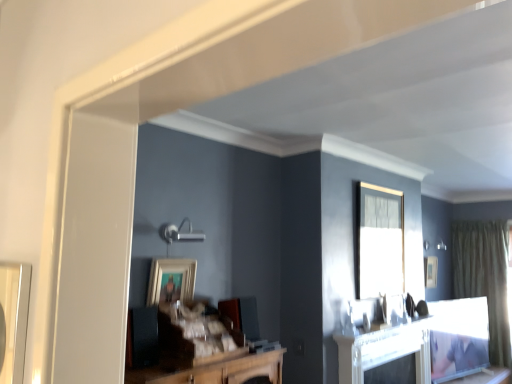
Question: Should I look upward or downward to see wooden framed picture at center, which appears as the 2th picture frame when viewed from the back?

Choices:
 (A) down
 (B) up

Answer: (A)

Question: Does wooden framed picture at center, which is the 1th picture frame in front-to-back order, lie behind white glossy fireplace at center?

Choices:
 (A) yes
 (B) no

Answer: (B)

Question: Considering the relative sizes of wooden framed picture at center, the first picture frame positioned from the left, and white glossy fireplace at center in the image provided, is wooden framed picture at center, the first picture frame positioned from the left, smaller than white glossy fireplace at center?

Choices:
 (A) no
 (B) yes

Answer: (B)

Question: Is wooden framed picture at center, acting as the 2th picture frame starting from the bottom, at the left side of white glossy fireplace at center?

Choices:
 (A) no
 (B) yes

Answer: (B)

Question: Does wooden framed picture at center, which appears as the 2th picture frame when viewed from the back, have a lesser height compared to white glossy fireplace at center?

Choices:
 (A) no
 (B) yes

Answer: (B)

Question: Is wooden framed picture at center, which appears as the 1th picture frame when viewed from the top, not inside white glossy fireplace at center?

Choices:
 (A) no
 (B) yes

Answer: (B)

Question: Does wooden framed picture at center, which appears as the 2th picture frame when viewed from the back, appear on the right side of white glossy fireplace at center?

Choices:
 (A) no
 (B) yes

Answer: (A)

Question: Does matte black picture frame at upper right, which is counted as the 2th picture frame, starting from the front, have a greater height compared to green textured curtain at right?

Choices:
 (A) no
 (B) yes

Answer: (A)

Question: Can you confirm if matte black picture frame at upper right, the second picture frame in the left-to-right sequence, is wider than green textured curtain at right?

Choices:
 (A) yes
 (B) no

Answer: (B)

Question: Can you confirm if matte black picture frame at upper right, which is counted as the 2th picture frame, starting from the front, is positioned to the left of green textured curtain at right?

Choices:
 (A) no
 (B) yes

Answer: (B)

Question: Can you confirm if matte black picture frame at upper right, which is counted as the 2th picture frame, starting from the front, is shorter than green textured curtain at right?

Choices:
 (A) no
 (B) yes

Answer: (B)

Question: Is matte black picture frame at upper right, the second picture frame in the left-to-right sequence, looking in the opposite direction of green textured curtain at right?

Choices:
 (A) yes
 (B) no

Answer: (B)

Question: From the image's perspective, is matte black picture frame at upper right, which is counted as the 2th picture frame, starting from the top, on green textured curtain at right?

Choices:
 (A) yes
 (B) no

Answer: (A)

Question: Is clear glass window at upper center facing towards matte black picture frame at upper right, positioned as the 1th picture frame in right-to-left order?

Choices:
 (A) yes
 (B) no

Answer: (B)